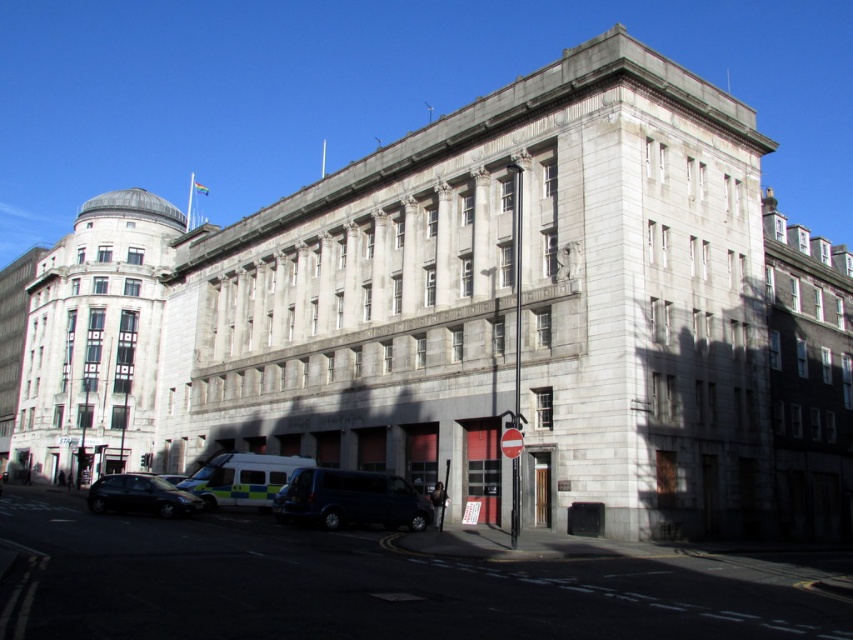
Question: Does dark blue van at center appear on the left side of white glossy ambulance at lower left?

Choices:
 (A) no
 (B) yes

Answer: (A)

Question: Observing the image, what is the correct spatial positioning of white glossy ambulance at lower left in reference to shiny black car at lower left?

Choices:
 (A) left
 (B) right

Answer: (B)

Question: Which point is closer to the camera taking this photo?

Choices:
 (A) (264, 456)
 (B) (114, 481)
 (C) (331, 499)

Answer: (C)

Question: Is dark blue van at center below shiny black car at lower left?

Choices:
 (A) no
 (B) yes

Answer: (A)

Question: Among these points, which one is nearest to the camera?

Choices:
 (A) (305, 515)
 (B) (265, 502)

Answer: (A)

Question: Among these points, which one is farthest from the camera?

Choices:
 (A) (260, 506)
 (B) (90, 500)

Answer: (A)